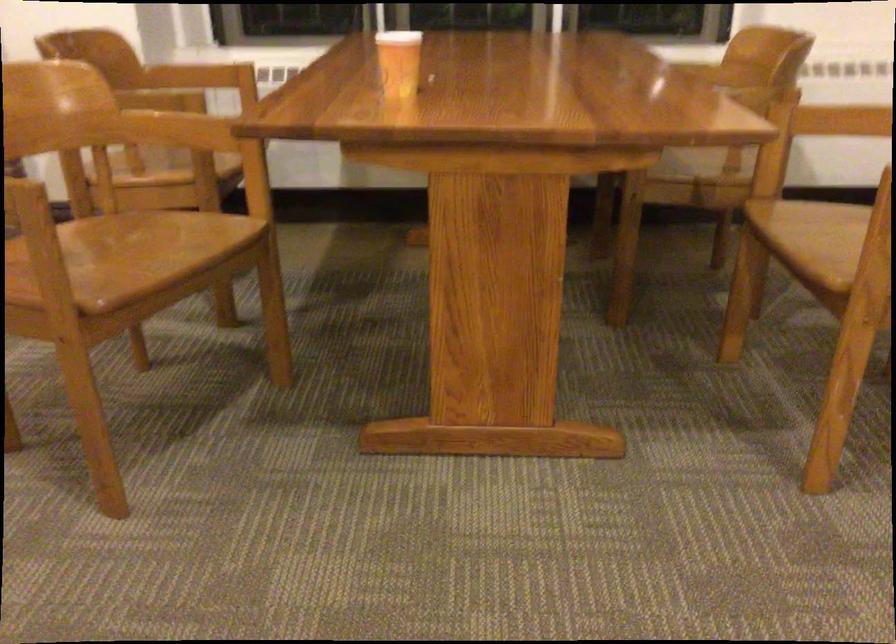
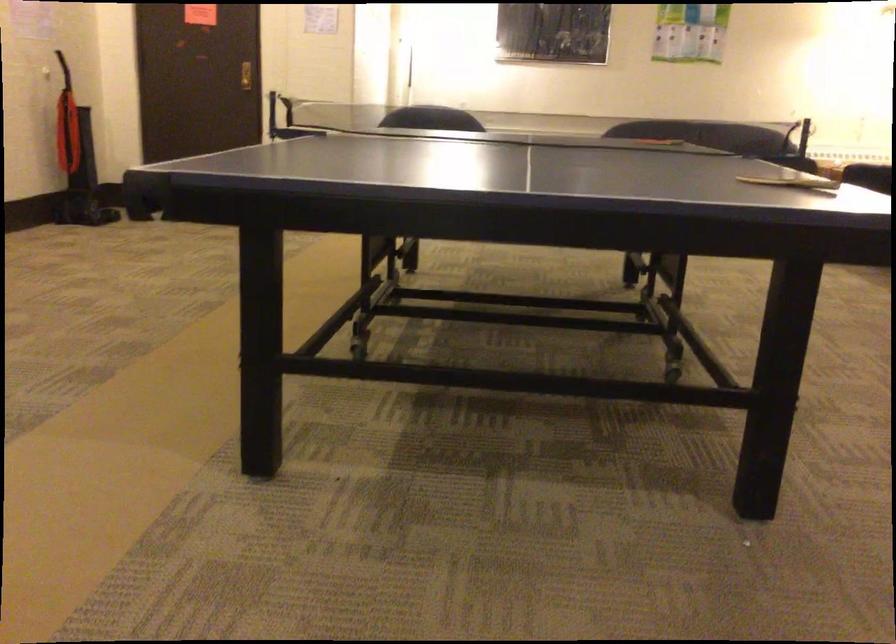
The images are taken continuously from a first-person perspective. In which direction is your viewpoint rotating?

The rotation direction of the camera is left-down.